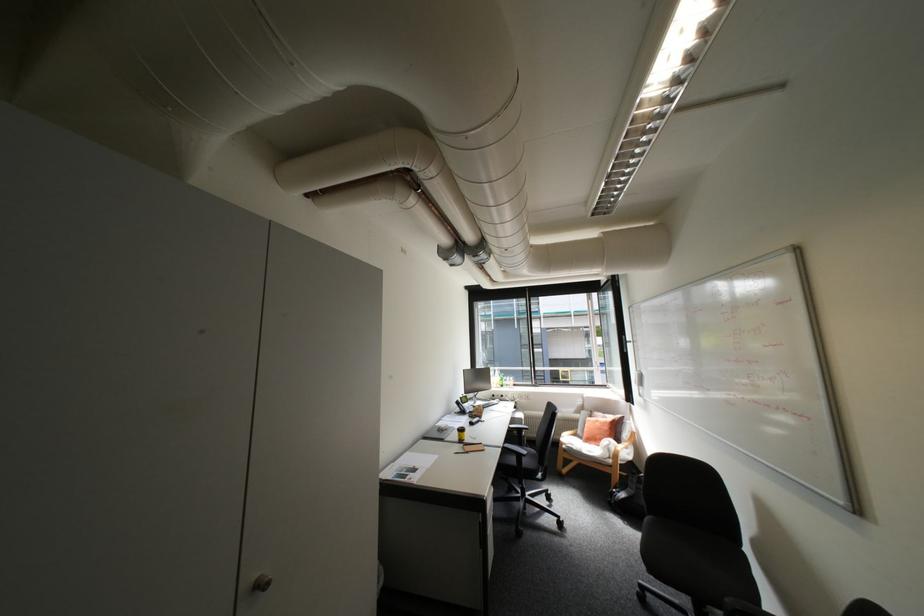
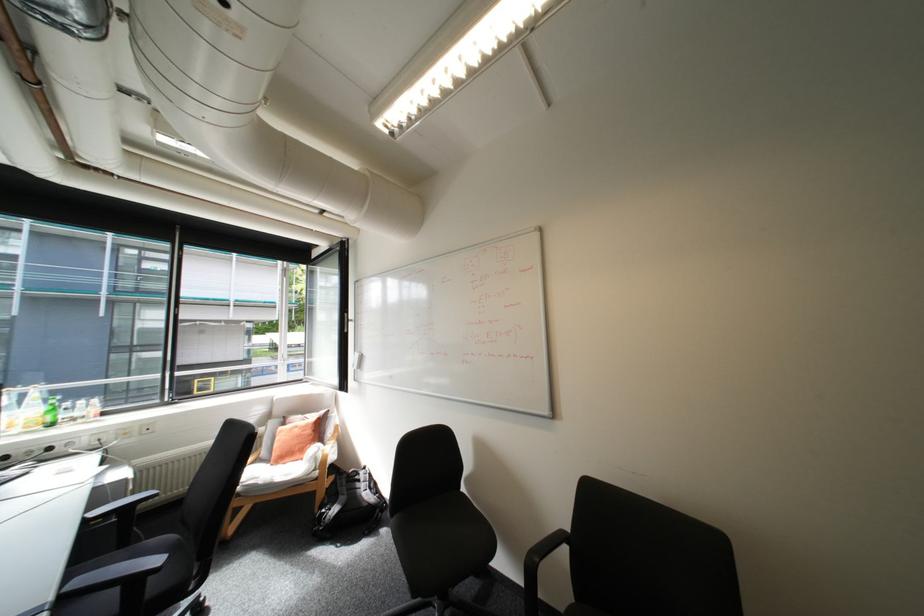
Question: The camera is either moving clockwise (left) or counter-clockwise (right) around the object. The first image is from the beginning of the video and the second image is from the end. Is the camera moving left or right when shooting the video?

Choices:
 (A) Left
 (B) Right

Answer: (A)